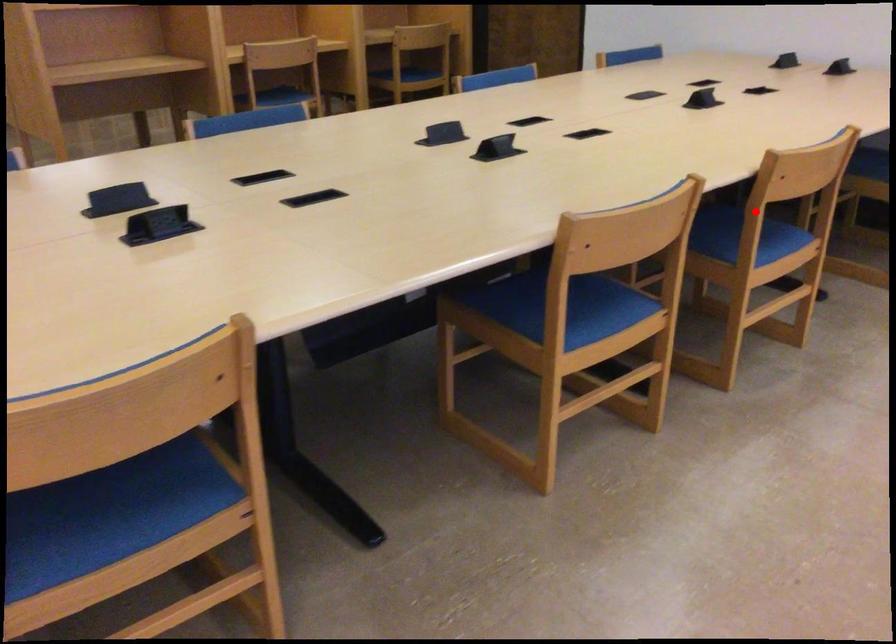
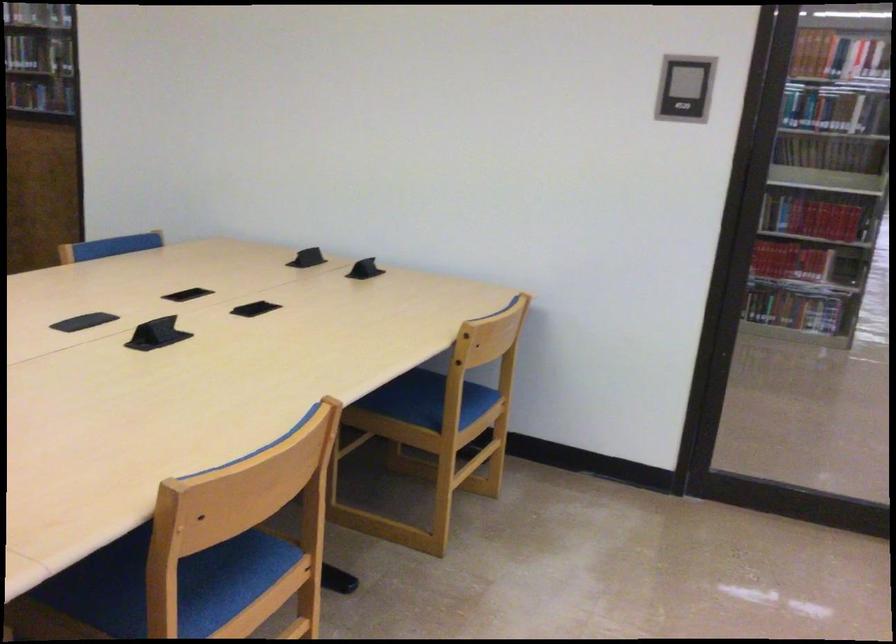
Question: I am providing you with two images of the same scene from different viewpoints. In image1, a red point is highlighted. Considering the same 3D point in image2, which of the following is correct?

Choices:
 (A) It is closer
 (B) It is farther

Answer: (A)